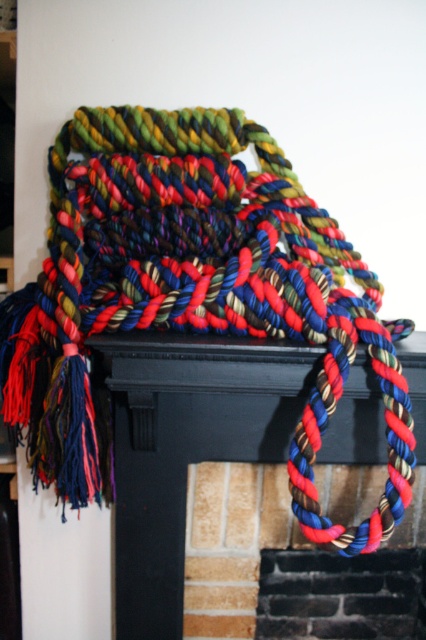
Question: Which point is closer to the camera taking this photo?

Choices:
 (A) (170, 490)
 (B) (189, 317)

Answer: (B)

Question: Is braided multicolored rope at center thinner than multicolored braided rope at center?

Choices:
 (A) no
 (B) yes

Answer: (A)

Question: Is braided multicolored rope at center further to camera compared to multicolored braided rope at center?

Choices:
 (A) yes
 (B) no

Answer: (B)

Question: Does braided multicolored rope at center have a smaller size compared to multicolored braided rope at center?

Choices:
 (A) yes
 (B) no

Answer: (B)

Question: Which point is closer to the camera?

Choices:
 (A) braided multicolored rope at center
 (B) multicolored braided rope at center

Answer: (A)